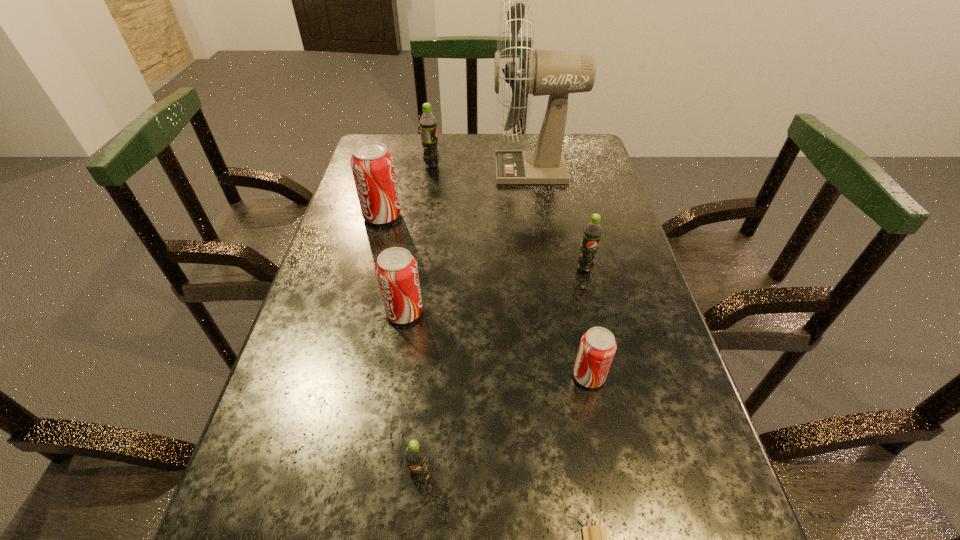
You are a GUI agent. You are given a task and a screenshot of the screen. Output one action in this format:
    pyautogui.click(x=<x>, y=<y>)
    Task: Click on the tallest object
    
    Given the screenshot: What is the action you would take?
    pyautogui.click(x=555, y=73)

Identify the location of fan. (555, 73).

Identify the location of the farthest red soda can. (372, 165).

Locate an element on the screen. The width and height of the screenshot is (960, 540). the biggest red soda can is located at coordinates (372, 165).

This screenshot has width=960, height=540. Find the location of `the leftmost green soda`. the leftmost green soda is located at coordinates (428, 123).

The height and width of the screenshot is (540, 960). I want to click on the biggest green soda, so click(x=428, y=123).

Image resolution: width=960 pixels, height=540 pixels. In order to click on the fifth farthest object in this screenshot , I will do `click(396, 270)`.

In order to click on the second biggest red soda can in this screenshot , I will do `click(396, 270)`.

Where is `the second biggest green soda`? the second biggest green soda is located at coordinates (592, 232).

Where is `the rightmost green soda`? This screenshot has width=960, height=540. the rightmost green soda is located at coordinates (592, 232).